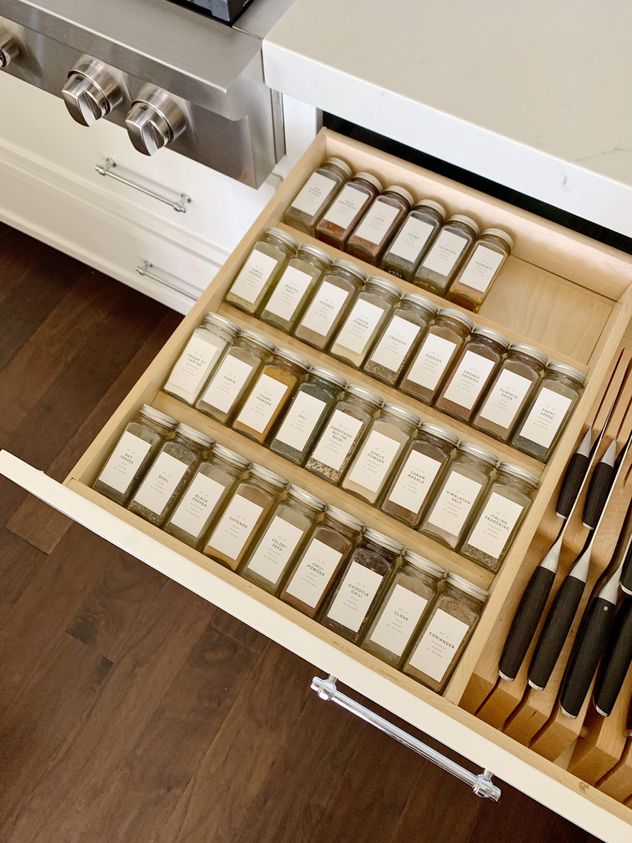
At what (x,y) coordinates should I click in order to perform the action: click on stainless steel oven. Please return your answer as a coordinate pair (x, y). This screenshot has height=843, width=632. Looking at the image, I should click on (214, 73).